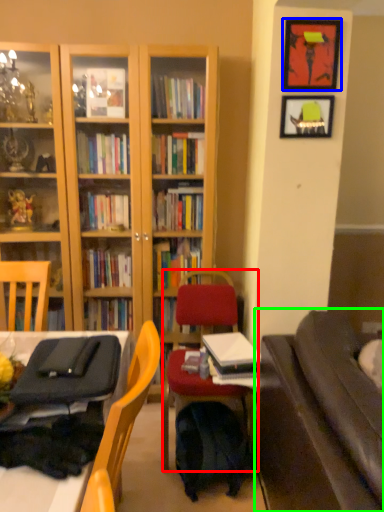
Question: Which is farther away from chair (highlighted by a red box)? picture frame (highlighted by a blue box) or studio couch (highlighted by a green box)?

Choices:
 (A) picture frame
 (B) studio couch

Answer: (A)